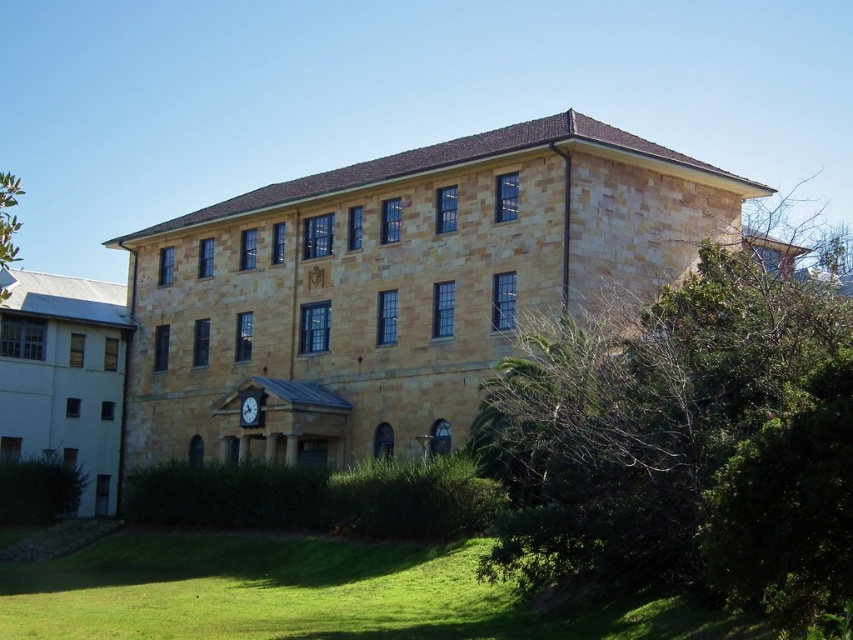
Question: Can you confirm if green leafy bush at lower right is positioned to the right of wooden clock at center?

Choices:
 (A) no
 (B) yes

Answer: (B)

Question: Is green grass at lower left positioned behind green leafy tree at upper left?

Choices:
 (A) yes
 (B) no

Answer: (B)

Question: Which point is farther to the camera?

Choices:
 (A) green grass at lower left
 (B) green leafy tree at upper left

Answer: (B)

Question: Is green grass at lower left above green leafy tree at upper left?

Choices:
 (A) yes
 (B) no

Answer: (B)

Question: Considering the real-world distances, which object is closest to the green leafy tree at upper left?

Choices:
 (A) green leafy bush at lower right
 (B) green grass at lower left

Answer: (B)

Question: Estimate the real-world distances between objects in this image. Which object is farther from the wooden clock at center?

Choices:
 (A) green grass at lower left
 (B) green leafy tree at upper left
 (C) green leafy bush at lower right

Answer: (B)